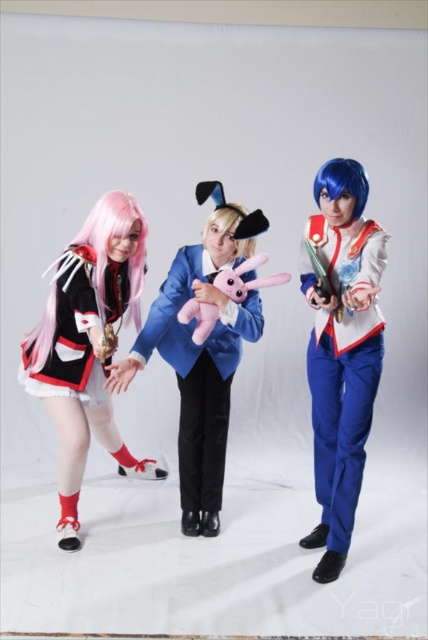
You are a photographer setting up a shoot. You have a matte black dress at left and a pink plush toy at center. Which object is taller?

The matte black dress at left is taller than the pink plush toy at center.